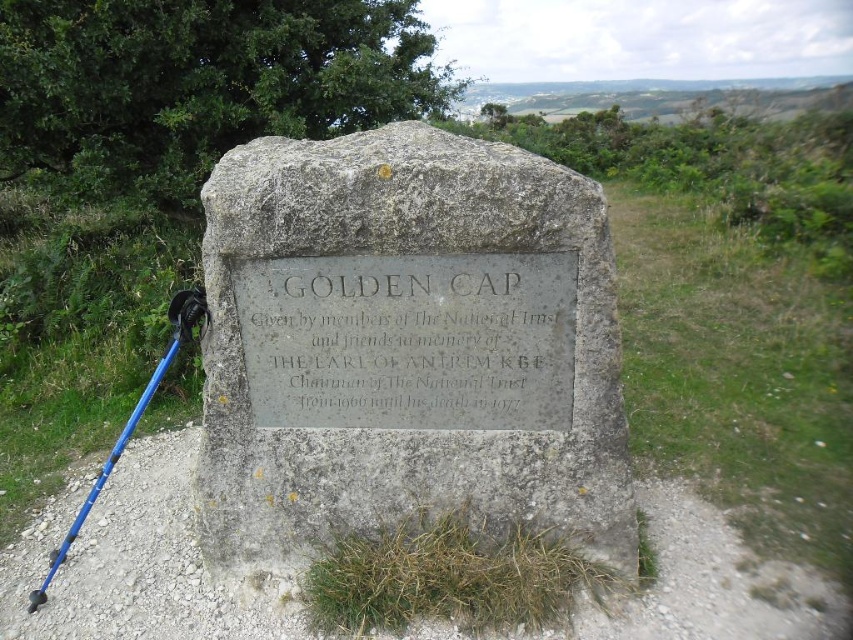
You are a hiker who just arrived at the memorial site. You have a blue plastic ski pole at lower left. Where is your ski pole located relative to the gray stone plaque at center?

The blue plastic ski pole at lower left is below the gray stone plaque at center because the gray stone plaque at center is above it.